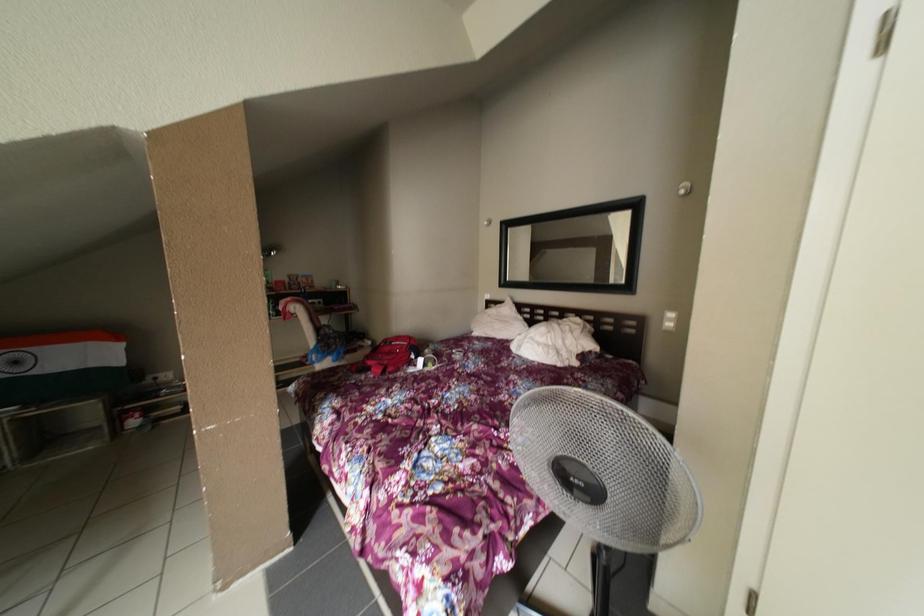
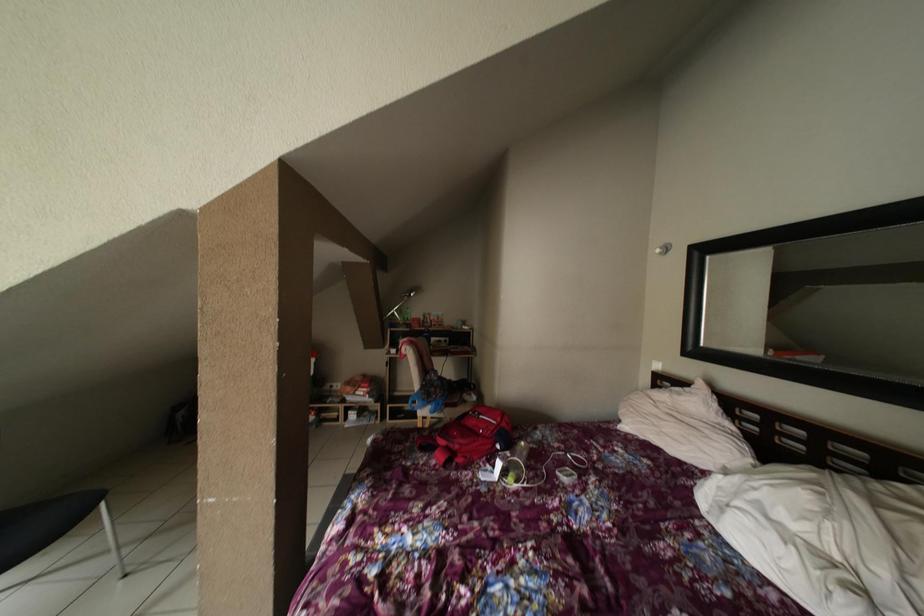
Question: The camera is either moving clockwise (left) or counter-clockwise (right) around the object. The first image is from the beginning of the video and the second image is from the end. Is the camera moving left or right when shooting the video?

Choices:
 (A) Left
 (B) Right

Answer: (B)